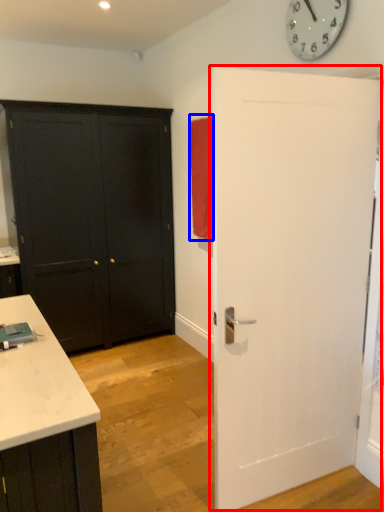
Question: Which object is closer to the camera taking this photo, door (highlighted by a red box) or curtain (highlighted by a blue box)?

Choices:
 (A) door
 (B) curtain

Answer: (A)